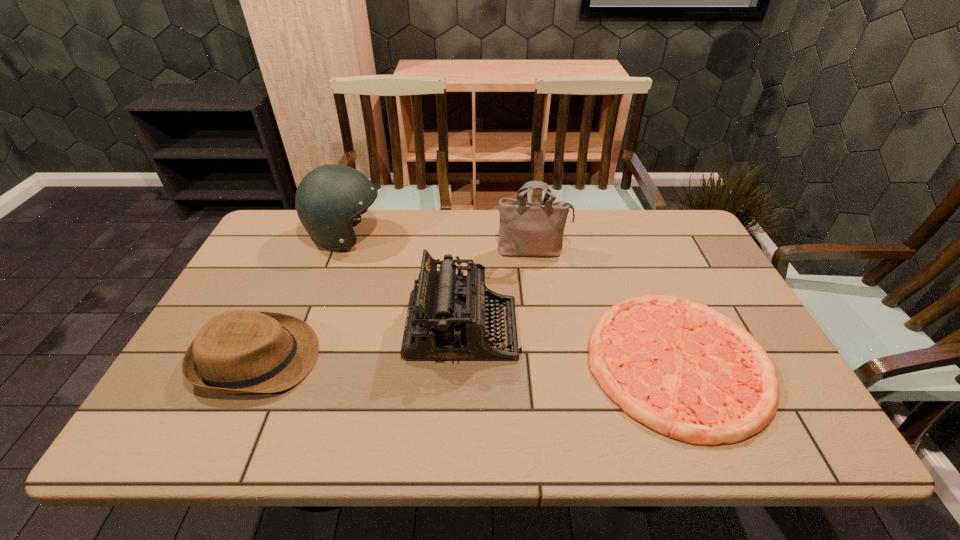
You are a GUI agent. You are given a task and a screenshot of the screen. Output one action in this format:
    pyautogui.click(x=<x>, y=<y>)
    Task: Click on the shoulder bag
    
    Given the screenshot: What is the action you would take?
    pyautogui.click(x=526, y=228)

Identify the location of football helmet. The height and width of the screenshot is (540, 960). (x=329, y=197).

Locate an element on the screen. This screenshot has width=960, height=540. typewriter is located at coordinates (448, 319).

Find the location of a particular element. This screenshot has width=960, height=540. the fourth tallest object is located at coordinates (240, 351).

You are a GUI agent. You are given a task and a screenshot of the screen. Output one action in this format:
    pyautogui.click(x=<x>, y=<y>)
    Task: Click on the pizza
    Image resolution: width=960 pixels, height=540 pixels.
    Given the screenshot: What is the action you would take?
    pyautogui.click(x=685, y=370)

Find the location of a particular element. free location located on the front-facing side of the shoulder bag is located at coordinates (540, 302).

At what (x,y) coordinates should I click in order to perform the action: click on vacant space located at the face opening of the football helmet. Please return your answer as a coordinate pair (x, y). The image size is (960, 540). Looking at the image, I should click on [x=488, y=235].

The width and height of the screenshot is (960, 540). In order to click on free space located on the keyboard of the typewriter in this screenshot , I will do 573,329.

Find the location of a particular element. This screenshot has height=540, width=960. free spot located on the front-facing side of the fedora is located at coordinates (452, 359).

Where is `free spot located on the back of the pizza`? The width and height of the screenshot is (960, 540). free spot located on the back of the pizza is located at coordinates (619, 221).